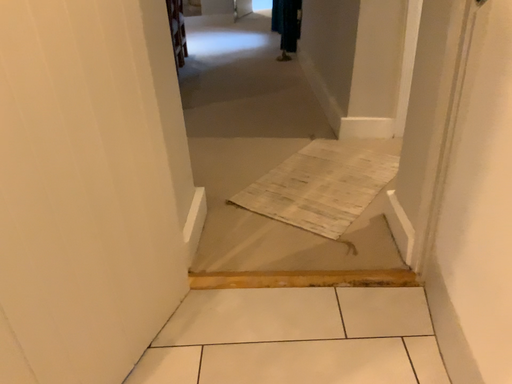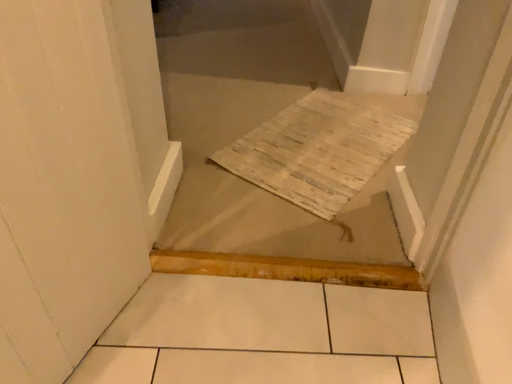
Question: Which way did the camera rotate in the video?

Choices:
 (A) rotated downward
 (B) rotated upward

Answer: (A)